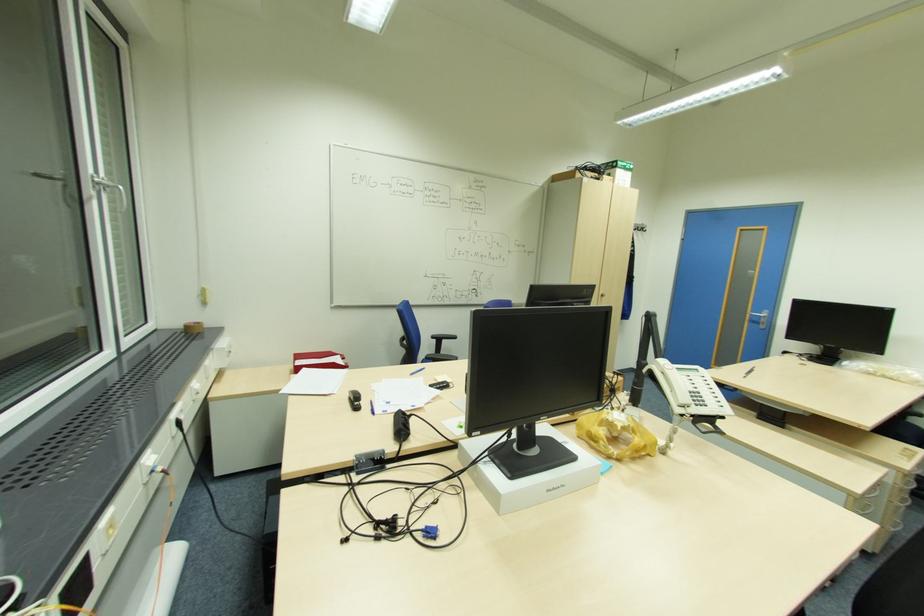
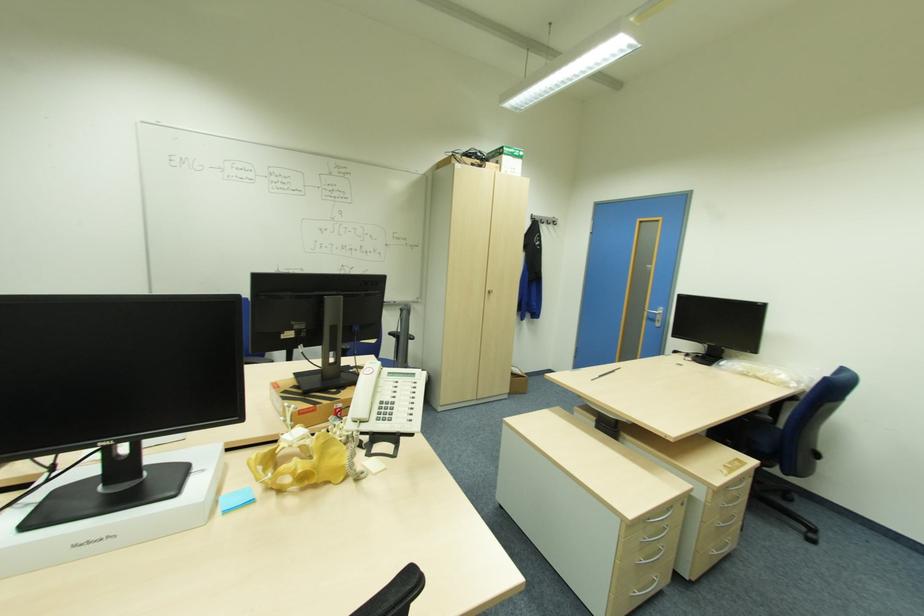
The point at (568, 442) is marked in the first image. Where is the corresponding point in the second image?

(207, 469)